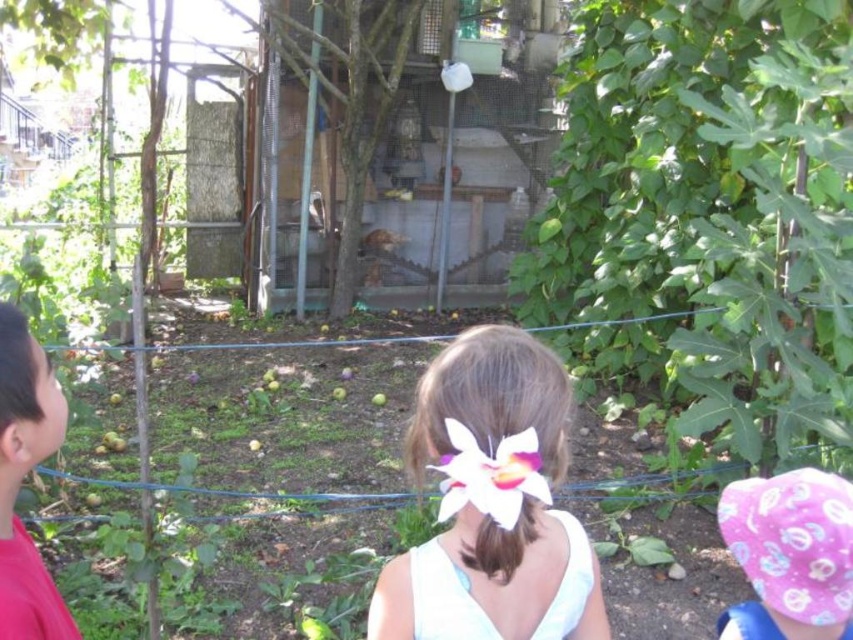
You are a photographer setting up a shot of the white fabric flower at center and the pink fabric hat at lower right. You want to ensure both are in focus. Which object should you adjust your focus on first if you want to prioritize the closer one?

The white fabric flower at center is closer than the pink fabric hat at lower right, so you should focus on the white fabric flower at center first.

You are a photographer trying to capture a group photo of the children in the scene. You notice the pink fabric hat at lower right and the red shirt at left. Which object should you focus on first if you want to ensure both are in sharp focus, considering their sizes?

The pink fabric hat at lower right is bigger than the red shirt at left, so you should focus on the pink fabric hat at lower right first to ensure both are in sharp focus since it is larger and might require more precise focusing.

You are standing in the backyard and want to place a new bird feeder. You have two points marked in the image for consideration. The first point is at coordinate point (815, 500) and the second is at point (4, 627). Which point is closer to you?

Point (815, 500) is further to the viewer than point (4, 627), so the second point is closer to you.